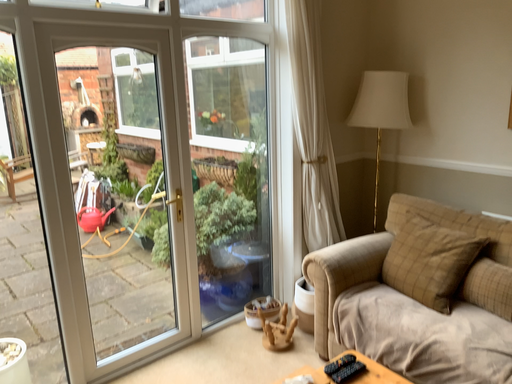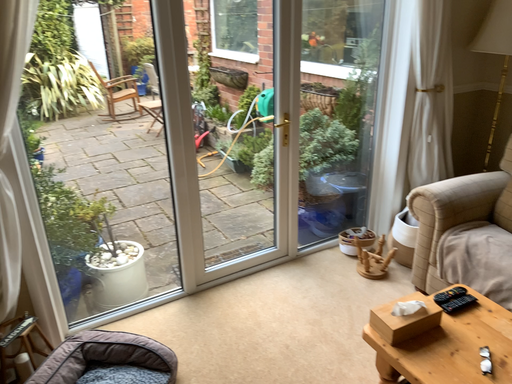
Question: How did the camera likely rotate when shooting the video?

Choices:
 (A) rotated downward
 (B) rotated upward

Answer: (A)